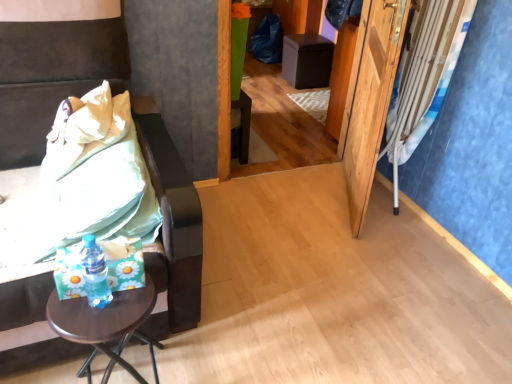
Identify the location of vacant space in between brown wooden table at lower left and blue fabric curtain at right. (285, 281).